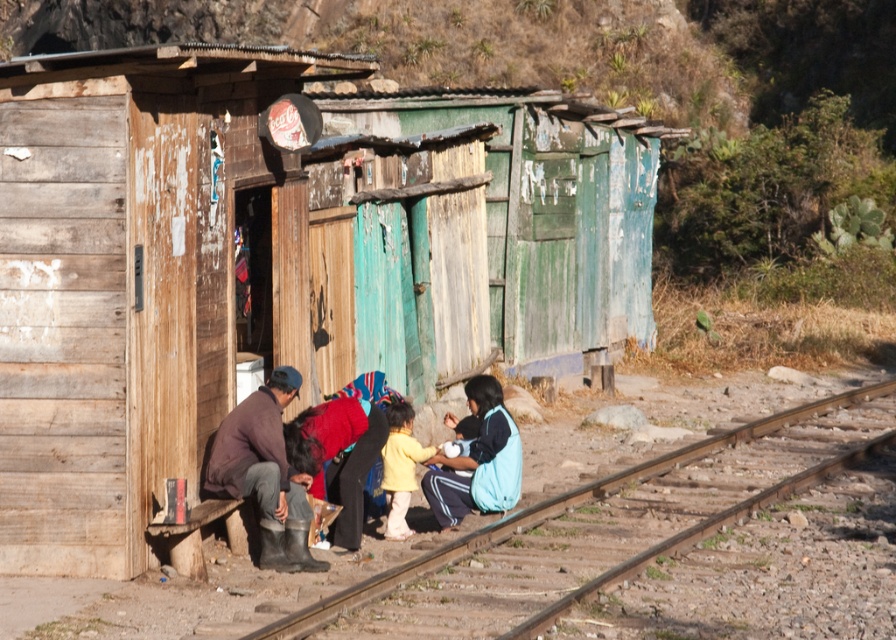
Question: Considering the relative positions of green weathered wood hut at center and brown wooden track at lower center in the image provided, where is green weathered wood hut at center located with respect to brown wooden track at lower center?

Choices:
 (A) above
 (B) below

Answer: (A)

Question: Is weathered wood hut at center positioned behind brown leather jacket at lower center?

Choices:
 (A) yes
 (B) no

Answer: (B)

Question: Which point is closer to the camera?

Choices:
 (A) (395, 461)
 (B) (203, 326)

Answer: (B)

Question: Which of the following is the closest to the observer?

Choices:
 (A) (821, 412)
 (B) (299, 500)
 (C) (453, 461)
 (D) (619, 122)

Answer: (B)

Question: Does brown leather jacket at left have a larger size compared to blue fleece jacket at lower right?

Choices:
 (A) yes
 (B) no

Answer: (B)

Question: Among these points, which one is farthest from the camera?

Choices:
 (A) (476, 396)
 (B) (410, 483)
 (C) (863, 396)
 (D) (272, 561)

Answer: (C)